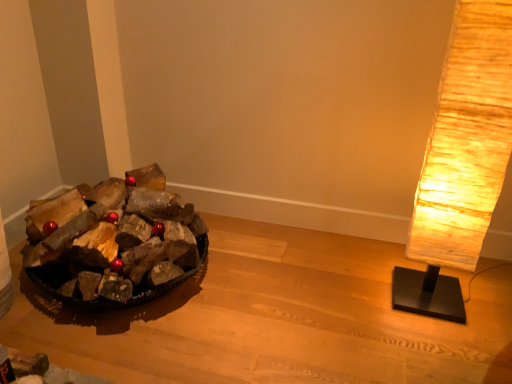
Question: From a real-world perspective, is wooden logs at left positioned over rustic paper lamp at right based on gravity?

Choices:
 (A) yes
 (B) no

Answer: (B)

Question: From the image's perspective, is wooden logs at left below rustic paper lamp at right?

Choices:
 (A) yes
 (B) no

Answer: (A)

Question: Could you tell me if wooden logs at left is facing rustic paper lamp at right?

Choices:
 (A) yes
 (B) no

Answer: (B)

Question: From the image's perspective, is wooden logs at left located above rustic paper lamp at right?

Choices:
 (A) no
 (B) yes

Answer: (A)

Question: From a real-world perspective, is wooden logs at left positioned under rustic paper lamp at right based on gravity?

Choices:
 (A) yes
 (B) no

Answer: (A)

Question: Is point (126, 193) closer or farther from the camera than point (473, 117)?

Choices:
 (A) farther
 (B) closer

Answer: (A)

Question: Considering the positions of dark brown wood at left and rustic paper lamp at right in the image, is dark brown wood at left taller or shorter than rustic paper lamp at right?

Choices:
 (A) tall
 (B) short

Answer: (B)

Question: Relative to rustic paper lamp at right, is dark brown wood at left in front or behind?

Choices:
 (A) behind
 (B) front

Answer: (A)

Question: Considering the positions of dark brown wood at left and rustic paper lamp at right in the image, is dark brown wood at left wider or thinner than rustic paper lamp at right?

Choices:
 (A) wide
 (B) thin

Answer: (A)

Question: Considering the positions of wooden logs at left and rustic paper lamp at right in the image, is wooden logs at left bigger or smaller than rustic paper lamp at right?

Choices:
 (A) small
 (B) big

Answer: (A)

Question: Considering the positions of point (287, 380) and point (460, 107), is point (287, 380) closer or farther from the camera than point (460, 107)?

Choices:
 (A) closer
 (B) farther

Answer: (B)

Question: Considering the relative positions of wooden logs at left and rustic paper lamp at right in the image provided, is wooden logs at left to the left or to the right of rustic paper lamp at right?

Choices:
 (A) left
 (B) right

Answer: (A)

Question: From a real-world perspective, is wooden logs at left above or below rustic paper lamp at right?

Choices:
 (A) below
 (B) above

Answer: (A)

Question: From the image's perspective, is dark brown wood at left above or below wooden logs at left?

Choices:
 (A) below
 (B) above

Answer: (B)

Question: Would you say dark brown wood at left is inside or outside wooden logs at left?

Choices:
 (A) outside
 (B) inside

Answer: (A)